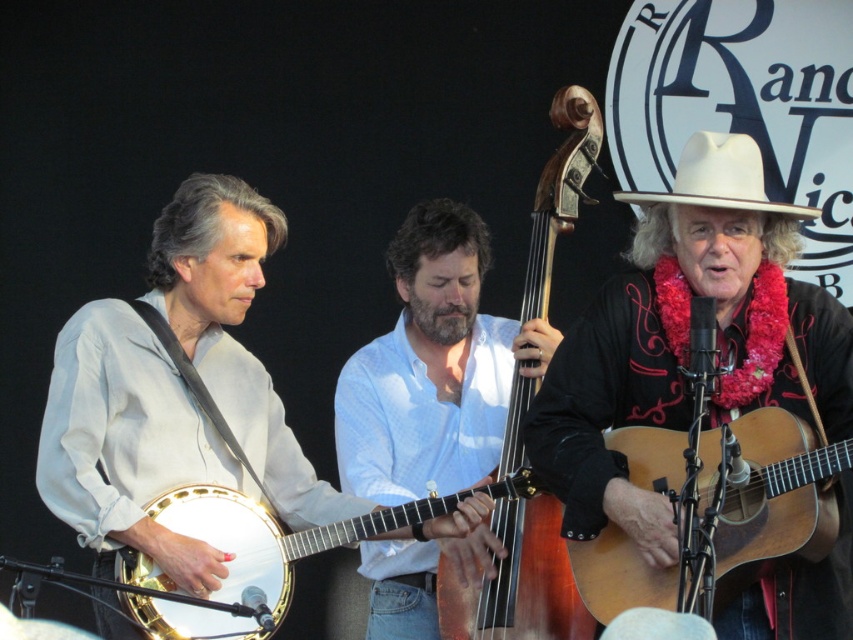
Question: Does light brown wooden guitar at right appear over matte white banjo at center?

Choices:
 (A) no
 (B) yes

Answer: (A)

Question: Based on their relative distances, which object is farther from the matte white banjo at center?

Choices:
 (A) wooden acoustic guitar at center
 (B) white wood banjo at left

Answer: (A)

Question: Can you confirm if white matte banjo at left is smaller than white wood banjo at left?

Choices:
 (A) no
 (B) yes

Answer: (A)

Question: Is white matte banjo at left thinner than light brown wooden guitar at right?

Choices:
 (A) no
 (B) yes

Answer: (A)

Question: Considering the real-world distances, which object is closest to the light blue woven shirt at center?

Choices:
 (A) white felt cowboy hat at upper right
 (B) light brown wooden guitar at right
 (C) white matte banjo at left
 (D) matte white banjo at center

Answer: (D)

Question: Which point is closer to the camera taking this photo?

Choices:
 (A) (351, 512)
 (B) (448, 616)
 (C) (674, 179)

Answer: (C)